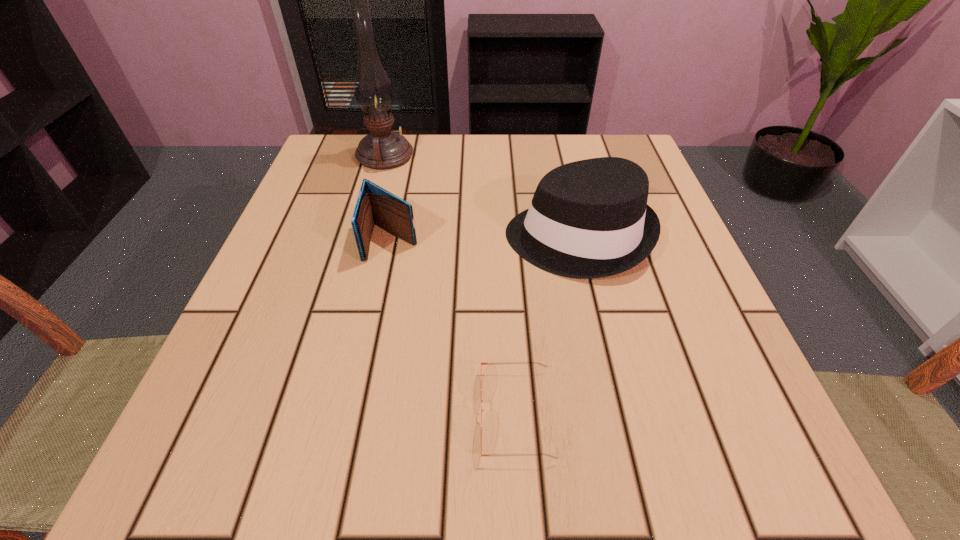
I want to click on free space located 0.080m on the face of the shortest object, so click(420, 413).

Where is `blank area located 0.250m on the face of the shortest object`? The height and width of the screenshot is (540, 960). blank area located 0.250m on the face of the shortest object is located at coordinates (290, 413).

The image size is (960, 540). I want to click on object that is at the far edge, so click(383, 149).

You are a GUI agent. You are given a task and a screenshot of the screen. Output one action in this format:
    pyautogui.click(x=<x>, y=<y>)
    Task: Click on the object that is at the near edge
    
    Given the screenshot: What is the action you would take?
    pyautogui.click(x=482, y=410)

Locate an element on the screen. The height and width of the screenshot is (540, 960). object that is at the left edge is located at coordinates (383, 149).

At what (x,y) coordinates should I click in order to perform the action: click on object present at the right edge. Please return your answer as a coordinate pair (x, y). Looking at the image, I should click on (588, 219).

Locate an element on the screen. object present at the far left corner is located at coordinates (383, 149).

Find the location of `vacant space at the far edge of the desktop`. vacant space at the far edge of the desktop is located at coordinates (444, 173).

Image resolution: width=960 pixels, height=540 pixels. Identify the location of free space at the left edge. (316, 232).

The height and width of the screenshot is (540, 960). Identify the location of vacant point at the right edge. (661, 377).